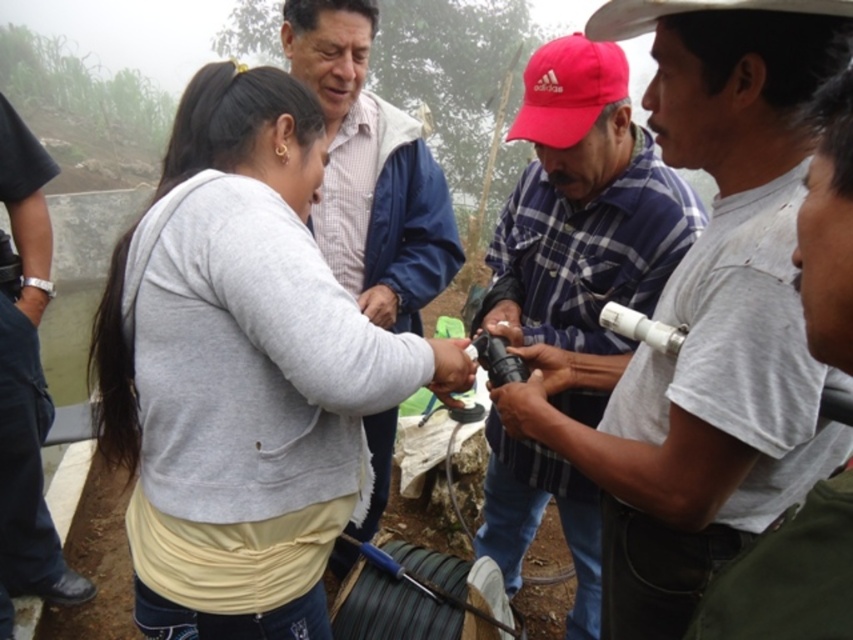
Question: Does light gray sweatshirt at center appear on the left side of plaid fabric shirt at center?

Choices:
 (A) no
 (B) yes

Answer: (B)

Question: Is the position of plaid fabric shirt at center less distant than that of black leather watch at left?

Choices:
 (A) no
 (B) yes

Answer: (B)

Question: Estimate the real-world distances between objects in this image. Which object is farther from the light gray sweatshirt at center?

Choices:
 (A) black leather watch at left
 (B) plaid fabric shirt at center
 (C) matte blue jacket at center

Answer: (A)

Question: Which object appears closest to the camera in this image?

Choices:
 (A) light gray sweatshirt at center
 (B) matte blue jacket at center
 (C) black leather watch at left

Answer: (A)

Question: Can you confirm if light gray sweatshirt at center is positioned to the left of black leather watch at left?

Choices:
 (A) yes
 (B) no

Answer: (B)

Question: Which point is farther to the camera?

Choices:
 (A) plaid fabric shirt at center
 (B) matte blue jacket at center
 (C) light gray sweatshirt at center

Answer: (A)